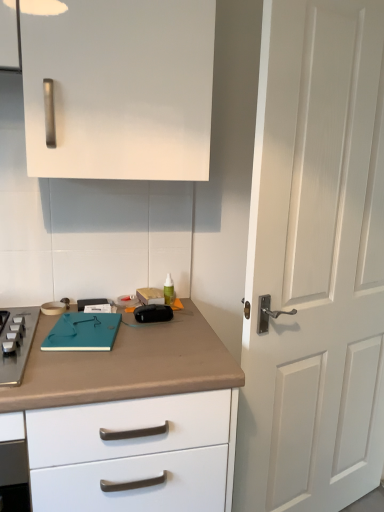
Find the location of a particular element. free spot in front of teal matte notebook at center is located at coordinates (80, 370).